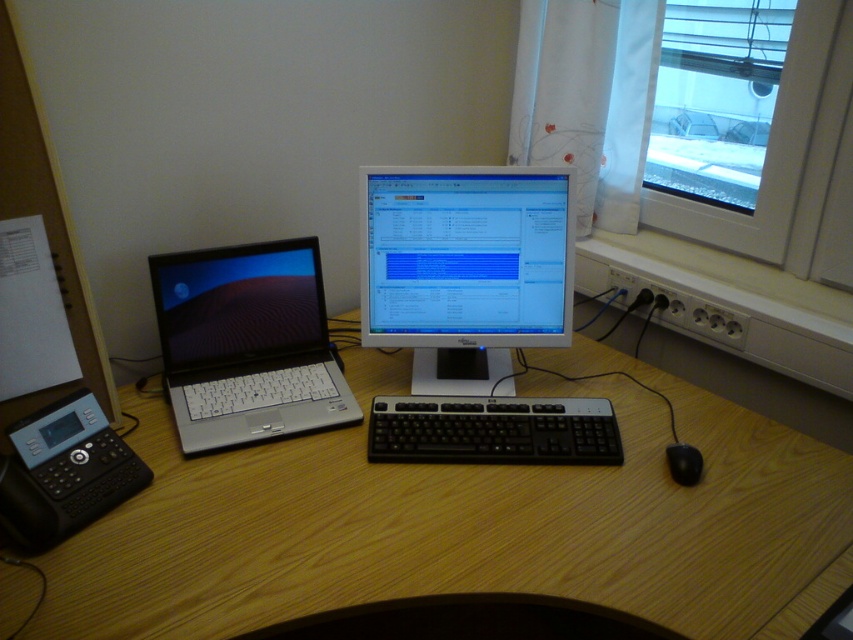
You are organizing the desk and need to place a new item between the black plastic keyboard at center and the transparent glass window at upper right. Since the keyboard is lower than the window, where should you position the new item to ensure it doesn

The black plastic keyboard at center has a lesser height compared to the transparent glass window at upper right, so positioning the new item between them would require placing it closer to the keyboard to maintain a smooth gradient from lower to higher heights.

You are organizing a desk and need to place a new mouse. The black plastic keyboard at center is currently occupying space. Can the mouse be placed on the transparent glass window at upper right without overlapping the keyboard?

The black plastic keyboard at center has a smaller size compared to transparent glass window at upper right, so there is enough space to place the mouse on the transparent glass window at upper right without overlapping the keyboard.